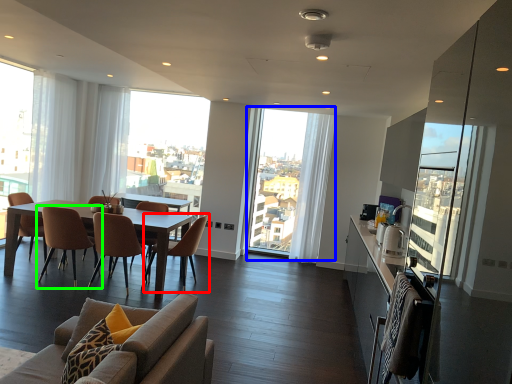
Question: Which is nearer to the chair (highlighted by a red box)? window (highlighted by a blue box) or chair (highlighted by a green box).

Choices:
 (A) window
 (B) chair

Answer: (B)